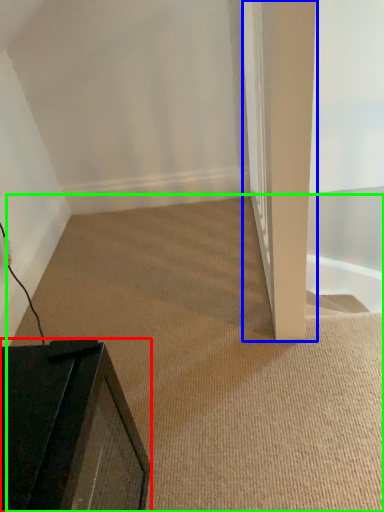
Question: Based on their relative distances, which object is farther from furniture (highlighted by a red box)? Choose from pillar (highlighted by a blue box) and plain (highlighted by a green box).

Choices:
 (A) pillar
 (B) plain

Answer: (A)